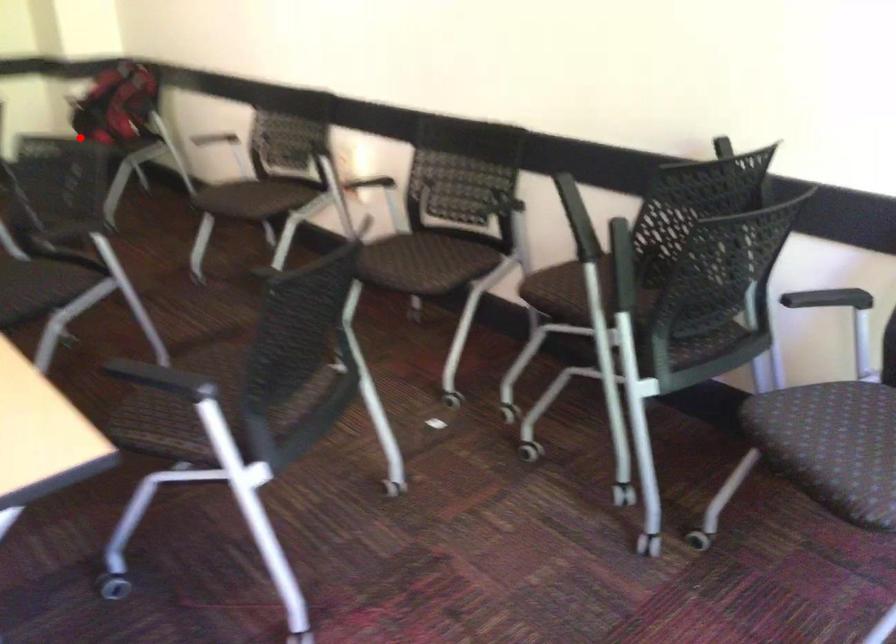
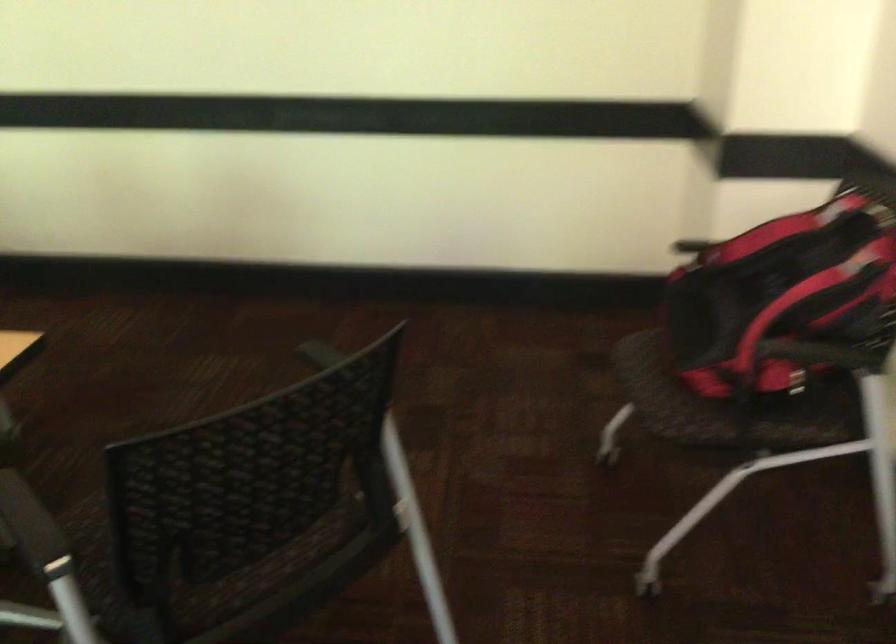
Question: I am providing you with two images of the same scene from different viewpoints. Given a red point in image1, look at the same physical point in image2. Is it:

Choices:
 (A) Closer to the viewpoint
 (B) Farther from the viewpoint

Answer: (A)